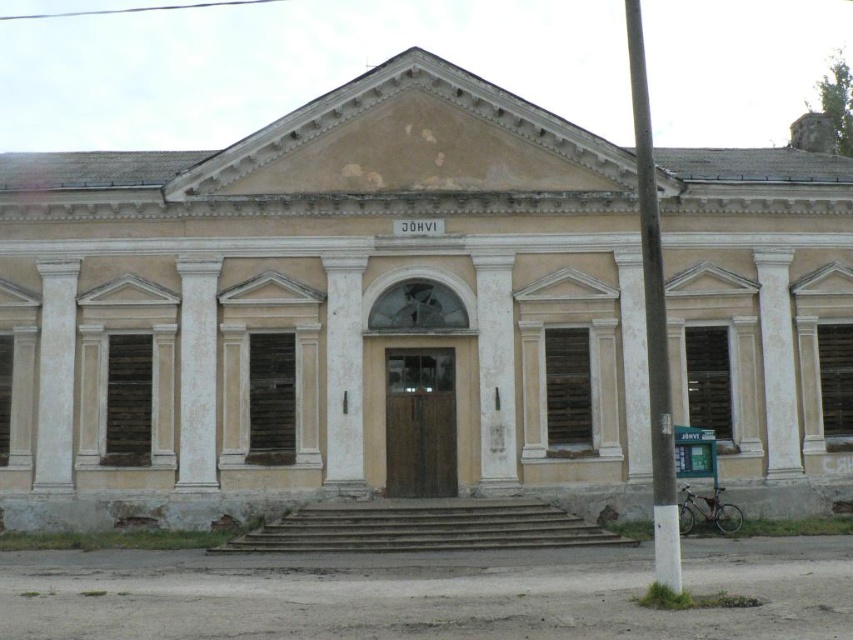
Does white painted wood pole at center right have a lesser height compared to white smooth column at center?

No, white painted wood pole at center right is not shorter than white smooth column at center.

Is white painted wood pole at center right smaller than white smooth column at center?

No.

Where is `white painted wood pole at center right`? white painted wood pole at center right is located at coordinates (653, 330).

Is white painted wood pole at center right closer to the viewer compared to white smooth pillar at center?

Yes.

Image resolution: width=853 pixels, height=640 pixels. I want to click on white painted wood pole at center right, so click(x=653, y=330).

Locate an element on the screen. white painted wood pole at center right is located at coordinates (653, 330).

Which is above, white painted wood pole at center right or white marble column at left?

Positioned higher is white painted wood pole at center right.

Based on the photo, between white painted wood pole at center right and white marble column at left, which one appears on the right side from the viewer's perspective?

From the viewer's perspective, white painted wood pole at center right appears more on the right side.

Is point (659, 408) positioned before point (38, 388)?

Yes.

Find the location of a particular element. white painted wood pole at center right is located at coordinates pos(653,330).